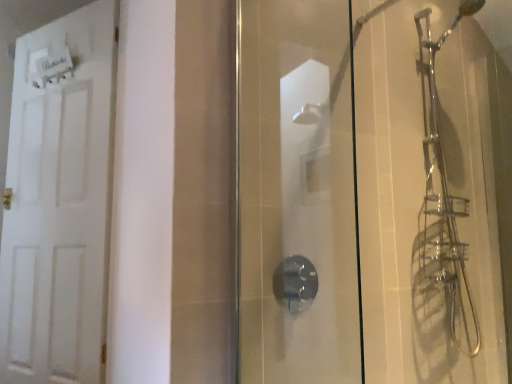
Question: Based on their sizes in the image, would you say white matte door at left is bigger or smaller than transparent glass shower door at center?

Choices:
 (A) big
 (B) small

Answer: (A)

Question: Is white matte door at left in front of or behind transparent glass shower door at center in the image?

Choices:
 (A) behind
 (B) front

Answer: (A)

Question: Does point (68, 221) appear closer or farther from the camera than point (294, 271)?

Choices:
 (A) closer
 (B) farther

Answer: (B)

Question: Is transparent glass shower door at center in front of or behind white matte door at left in the image?

Choices:
 (A) front
 (B) behind

Answer: (A)

Question: Would you say transparent glass shower door at center is inside or outside white matte door at left?

Choices:
 (A) inside
 (B) outside

Answer: (B)

Question: Considering the positions of transparent glass shower door at center and white matte door at left in the image, is transparent glass shower door at center taller or shorter than white matte door at left?

Choices:
 (A) short
 (B) tall

Answer: (A)

Question: Based on their positions, is transparent glass shower door at center located to the left or right of white matte door at left?

Choices:
 (A) left
 (B) right

Answer: (B)